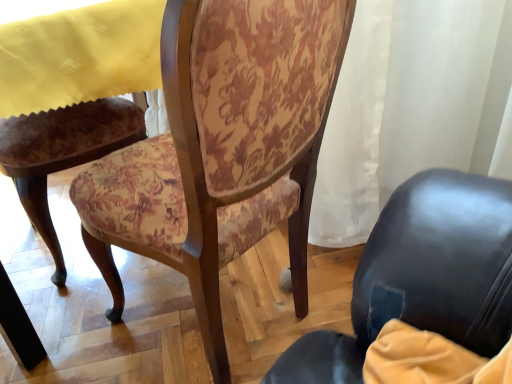
Question: Based on their sizes in the image, would you say floral fabric chair at center is bigger or smaller than yellow fabric at upper left?

Choices:
 (A) big
 (B) small

Answer: (A)

Question: Is point (207, 345) positioned closer to the camera than point (86, 31)?

Choices:
 (A) closer
 (B) farther

Answer: (A)

Question: From a real-world perspective, is floral fabric chair at center physically located above or below yellow fabric at upper left?

Choices:
 (A) above
 (B) below

Answer: (B)

Question: Considering the positions of yellow fabric at upper left and floral fabric chair at center in the image, is yellow fabric at upper left taller or shorter than floral fabric chair at center?

Choices:
 (A) short
 (B) tall

Answer: (A)

Question: From the image's perspective, is yellow fabric at upper left positioned above or below floral fabric chair at center?

Choices:
 (A) below
 (B) above

Answer: (B)

Question: From a real-world perspective, relative to floral fabric chair at center, is yellow fabric at upper left vertically above or below?

Choices:
 (A) below
 (B) above

Answer: (B)

Question: Looking at their shapes, would you say yellow fabric at upper left is wider or thinner than floral fabric chair at center?

Choices:
 (A) thin
 (B) wide

Answer: (A)